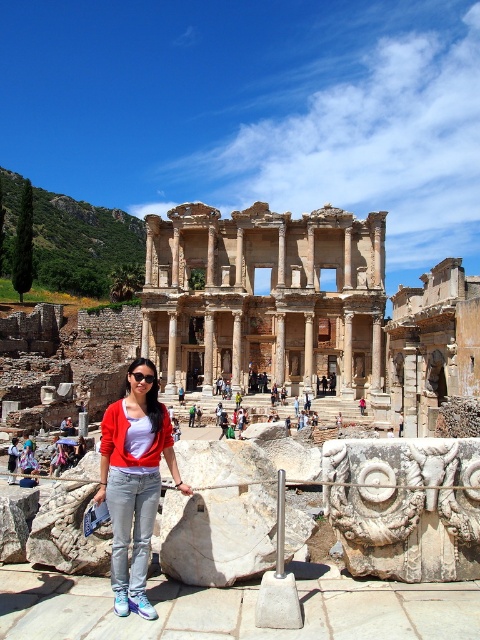
You are a photographer planning to capture a wide shot of the brown stone ruins at center and the denim jacket at center. Given their sizes, which object will occupy more space in the photo?

The brown stone ruins at center will occupy more space in the photo because its width is larger than that of the denim jacket at center.

From the picture: You are standing at the point marked as point (264, 298) in the image. What do you see directly in front of you?

You see brown stone ruins at center directly in front of you.